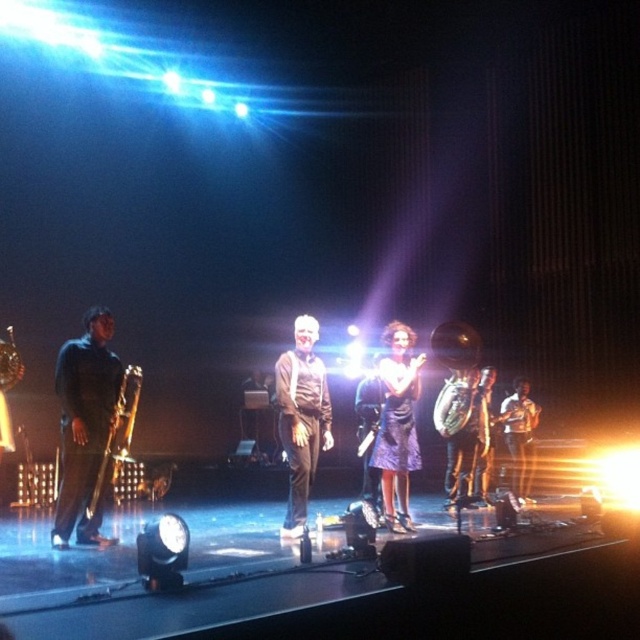
You are a photographer setting up for a concert photo shoot. You have a camera with a 50mm lens that has a maximum aperture of f1.4. You want to take a photo where both the shiny purple dress at center and the matte black trombone at left are in focus. Given the depth of field considerations, which object should you focus on to ensure both are sharp?

To ensure both the shiny purple dress at center and the matte black trombone at left are in focus, you should focus on the shiny purple dress at center since it is larger and closer to the camera than the matte black trombone at left, allowing for better depth of field coverage.

You are a photographer trying to capture the performer in the shiny purple dress at center and the musician with the matte black trombone at left. Based on their positions, which one is closer to the right edge of the stage?

The shiny purple dress at center is positioned on the right side of matte black trombone at left, so the shiny purple dress at center is closer to the right edge of the stage.

You are a stagehand setting up a storage rack for instruments. The rack has two shelves. The top shelf can only hold items that take up less space than the bottom shelf. You need to place the matte black trombone at left and the shiny gold tuba at center. Which instrument should go on the top shelf?

The matte black trombone at left should be placed on the top shelf because it occupies less space than the shiny gold tuba at center, which must go on the bottom shelf.